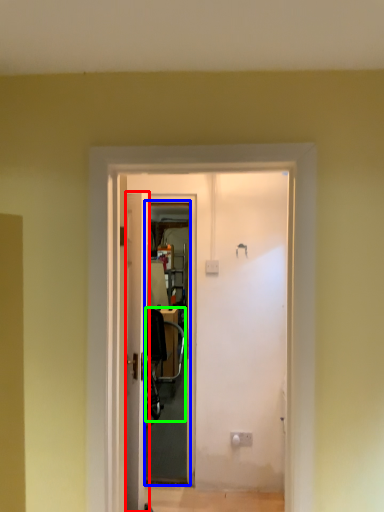
Question: Estimate the real-world distances between objects in this image. Which object is closer to door (highlighted by a red box), screen door (highlighted by a blue box) or chair (highlighted by a green box)?

Choices:
 (A) screen door
 (B) chair

Answer: (A)